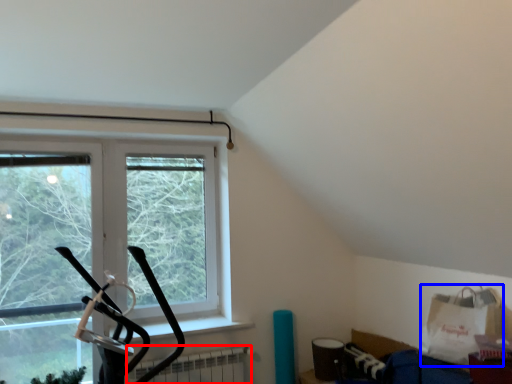
Question: Which point is closer to the camera, radiator (highlighted by a red box) or grocery bag (highlighted by a blue box)?

Choices:
 (A) radiator
 (B) grocery bag

Answer: (B)